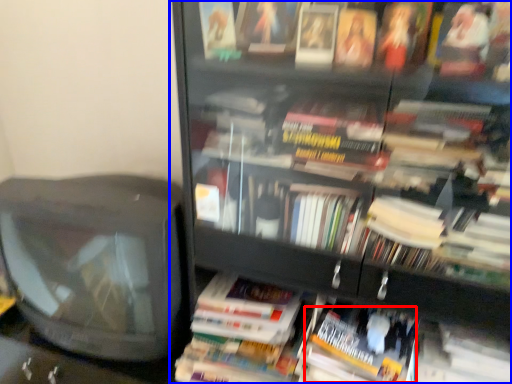
Question: Which of the following is the farthest to the observer, paperback book (highlighted by a red box) or bookcase (highlighted by a blue box)?

Choices:
 (A) paperback book
 (B) bookcase

Answer: (A)